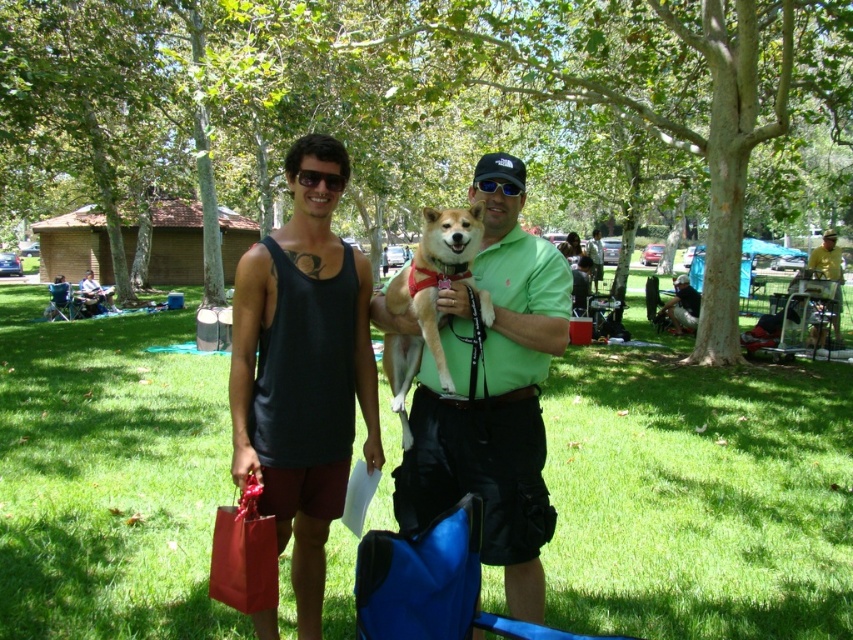
Question: Which point appears farthest from the camera in this image?

Choices:
 (A) tap(323, 572)
 (B) tap(432, 246)

Answer: (A)

Question: Which point appears farthest from the camera in this image?

Choices:
 (A) (596, 262)
 (B) (305, 166)
 (C) (469, 278)
 (D) (44, 312)

Answer: (A)

Question: Is black tank top at center to the right of matte black tank top at center from the viewer's perspective?

Choices:
 (A) no
 (B) yes

Answer: (B)

Question: Can you confirm if matte black tank top at center is bigger than green matte shirt at center?

Choices:
 (A) yes
 (B) no

Answer: (B)

Question: Which of the following is the farthest from the observer?

Choices:
 (A) (241, 291)
 (B) (517, 464)

Answer: (B)

Question: Is green cotton shirt at center bigger than sunglasses at center?

Choices:
 (A) no
 (B) yes

Answer: (B)